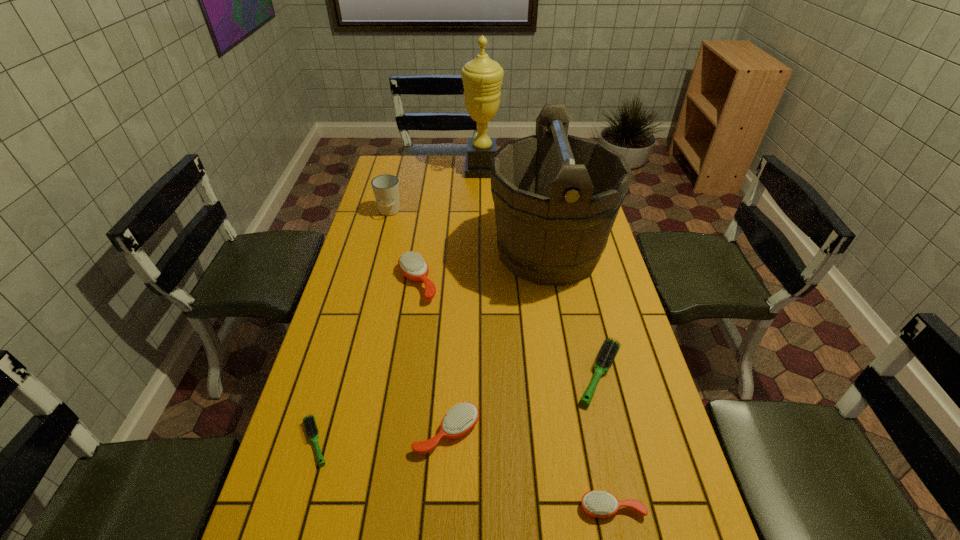
I want to click on vacant space situated 0.310m on the front of the farthest orange hairbrush, so click(x=400, y=393).

Image resolution: width=960 pixels, height=540 pixels. Find the location of `free location located on the back of the fourth shortest object`. free location located on the back of the fourth shortest object is located at coordinates (454, 314).

Where is `free space located 0.300m on the left of the bigger light hairbrush`? The height and width of the screenshot is (540, 960). free space located 0.300m on the left of the bigger light hairbrush is located at coordinates (462, 374).

Find the location of `blank area located on the left of the nearest orange hairbrush`. blank area located on the left of the nearest orange hairbrush is located at coordinates (463, 508).

Identify the location of vacant space located on the right of the shortest hairbrush. The height and width of the screenshot is (540, 960). (362, 442).

At what (x,y) coordinates should I click in order to perform the action: click on object present at the far edge. Please return your answer as a coordinate pair (x, y). The image size is (960, 540). Looking at the image, I should click on (482, 77).

Where is `cup at the left edge`? cup at the left edge is located at coordinates (385, 187).

Where is `hairbrush at the left edge`? The height and width of the screenshot is (540, 960). hairbrush at the left edge is located at coordinates (309, 422).

Locate an element on the screen. The width and height of the screenshot is (960, 540). bucket present at the right edge is located at coordinates (556, 198).

Identify the location of free space at the left edge of the desktop. The image size is (960, 540). (336, 458).